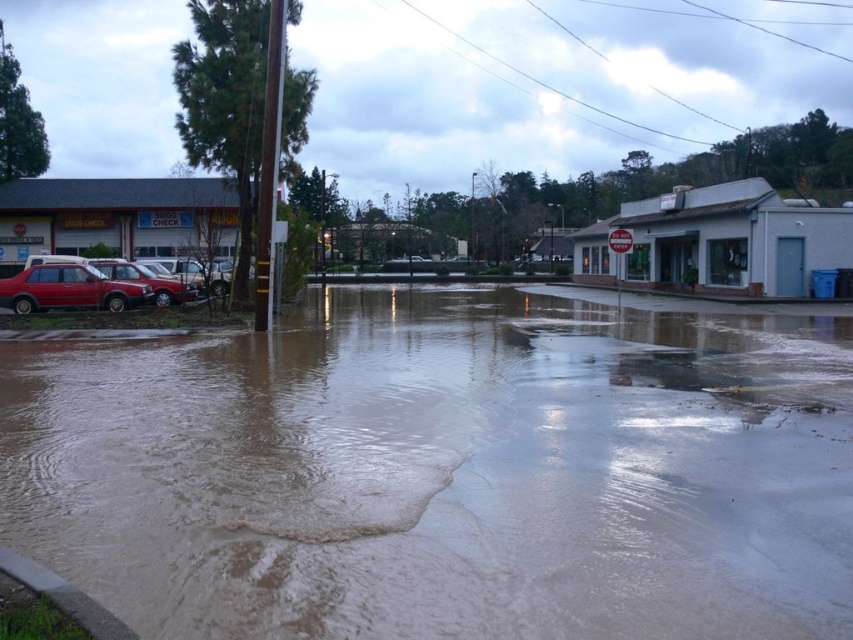
You are a pedestrian trying to cross the flooded street. You see the brown muddy water at center and the matte red car at lower left. Which object is closer to you as you approach the street?

The brown muddy water at center is closer to you because it is in front of the matte red car at lower left, meaning the car is behind the water from your perspective.

You are a pedestrian trying to cross the flooded street. You see two matte red cars, the matte red car at left and the matte red car at lower left. Which direction should you walk to reach the one that is positioned to your right?

The matte red car at left is to the right of the matte red car at lower left, so you should walk towards the matte red car at left to reach the one positioned to your right.